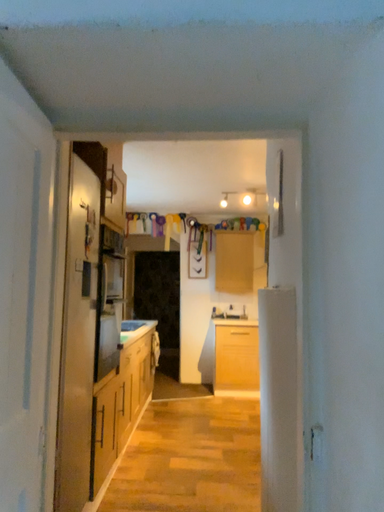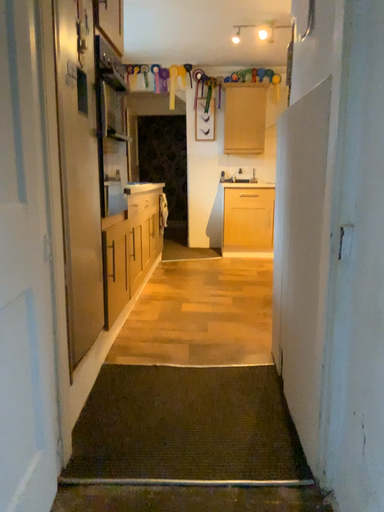
Question: How did the camera likely rotate when shooting the video?

Choices:
 (A) rotated upward
 (B) rotated downward

Answer: (B)